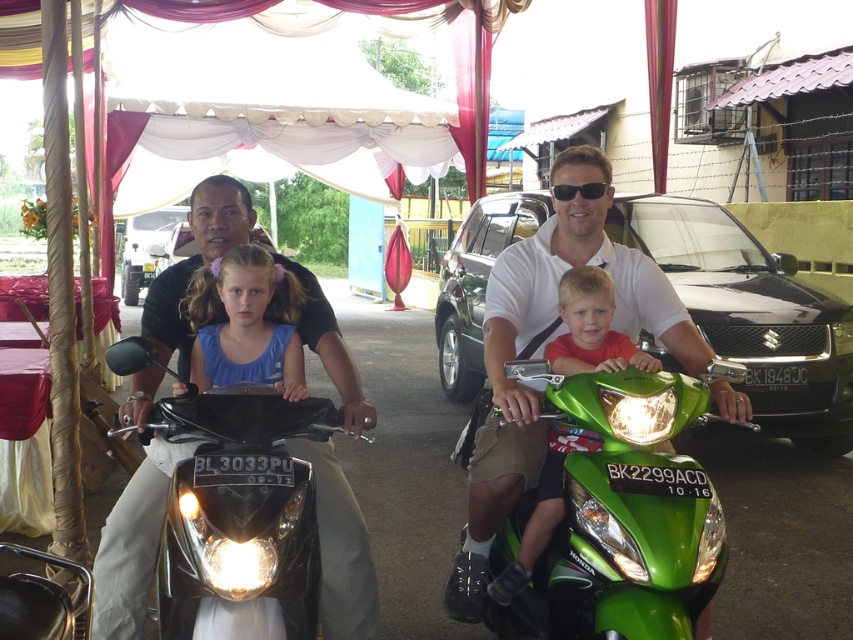
You are a photographer positioned at the edge of the scene. You want to capture both the black metallic car at center and the matte green motorcycle at center in a single shot. Your camera has a maximum focal length that allows capturing objects within a 4 meter range. Can you include both in your photo?

The distance between the black metallic car at center and the matte green motorcycle at center is 3.77 meters, which is within the camera range of 4 meters. Therefore, you can include both in your photo.

You are a photographer at the event and want to capture both the black metallic car at center and the matte green motorcycle at center in one frame. Which one will appear taller in the photo?

The black metallic car at center will appear taller in the photo because it is much taller than the matte green motorcycle at center according to the description.